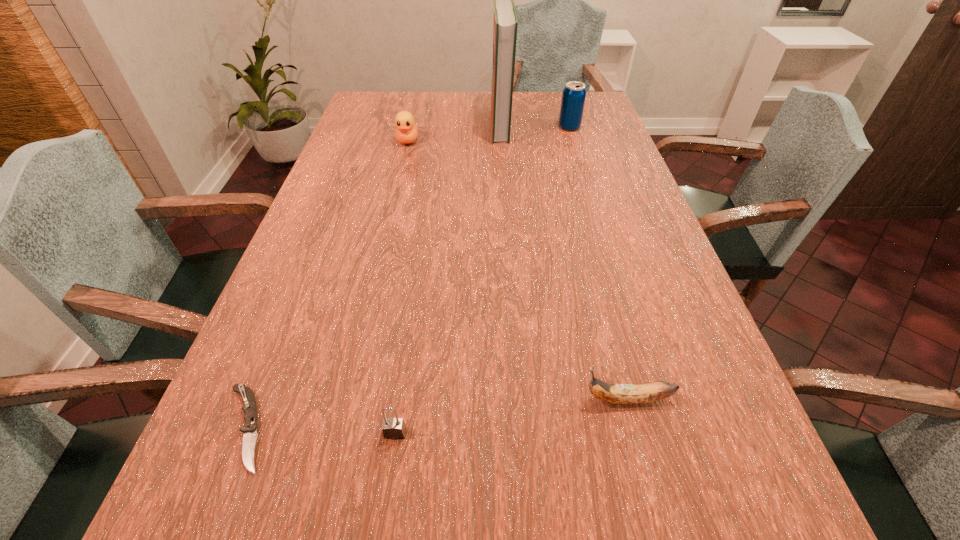
I want to click on the third object from right to left, so click(x=505, y=24).

Locate an element on the screen. hardback book is located at coordinates [505, 24].

The width and height of the screenshot is (960, 540). Find the location of `the fifth shortest object`. the fifth shortest object is located at coordinates (574, 93).

Identify the location of the second object from left to right. (406, 132).

You are a GUI agent. You are given a task and a screenshot of the screen. Output one action in this format:
    pyautogui.click(x=<x>, y=<y>)
    Task: Click on the banana
    
    Given the screenshot: What is the action you would take?
    pyautogui.click(x=624, y=394)

The width and height of the screenshot is (960, 540). Identify the location of the third object from left to right. (393, 428).

This screenshot has width=960, height=540. What are the coordinates of `pocketknife` in the screenshot? It's located at (249, 429).

At what (x,y) coordinates should I click in order to perform the action: click on the shortest object. Please return your answer as a coordinate pair (x, y). This screenshot has width=960, height=540. Looking at the image, I should click on (249, 429).

The width and height of the screenshot is (960, 540). I want to click on free space located 0.380m on the cover of the third object from right to left, so click(x=378, y=126).

The image size is (960, 540). I want to click on vacant space located 0.080m on the cover of the third object from right to left, so click(x=467, y=126).